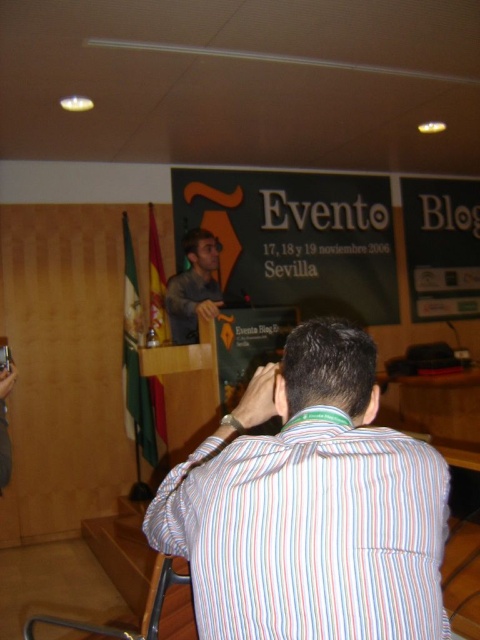
Question: Which of the following is the farthest from the observer?

Choices:
 (A) dark gray fabric shirt at center
 (B) striped cotton shirt at back

Answer: (A)

Question: Is striped cotton shirt at back bigger than dark gray fabric shirt at center?

Choices:
 (A) no
 (B) yes

Answer: (A)

Question: Is the position of striped cotton shirt at back less distant than that of dark gray fabric shirt at center?

Choices:
 (A) no
 (B) yes

Answer: (B)

Question: Which point is closer to the camera?

Choices:
 (A) dark gray fabric shirt at center
 (B) striped cotton shirt at back

Answer: (B)

Question: Is striped cotton shirt at back bigger than dark gray fabric shirt at center?

Choices:
 (A) no
 (B) yes

Answer: (A)